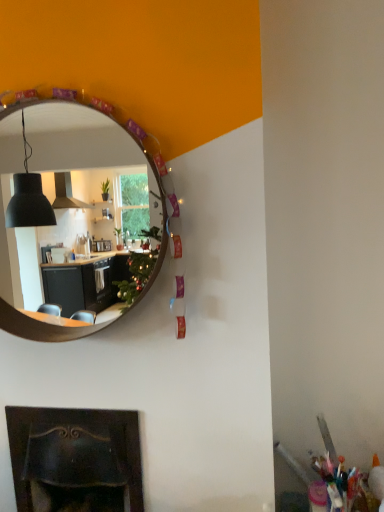
Question: Could you tell me if dark brown wood fireplace at lower left is facing wooden mirror at upper center?

Choices:
 (A) no
 (B) yes

Answer: (A)

Question: Is wooden mirror at upper center inside dark brown wood fireplace at lower left?

Choices:
 (A) no
 (B) yes

Answer: (A)

Question: Does dark brown wood fireplace at lower left have a larger size compared to wooden mirror at upper center?

Choices:
 (A) yes
 (B) no

Answer: (A)

Question: From the image's perspective, does dark brown wood fireplace at lower left appear higher than wooden mirror at upper center?

Choices:
 (A) yes
 (B) no

Answer: (B)

Question: Is dark brown wood fireplace at lower left facing away from wooden mirror at upper center?

Choices:
 (A) no
 (B) yes

Answer: (A)

Question: Is dark brown wood fireplace at lower left closer to the viewer compared to wooden mirror at upper center?

Choices:
 (A) yes
 (B) no

Answer: (B)

Question: From the image's perspective, would you say wooden mirror at upper center is shown under dark brown wood fireplace at lower left?

Choices:
 (A) no
 (B) yes

Answer: (A)

Question: Could you tell me if wooden mirror at upper center is facing dark brown wood fireplace at lower left?

Choices:
 (A) yes
 (B) no

Answer: (B)

Question: Can we say wooden mirror at upper center lies outside dark brown wood fireplace at lower left?

Choices:
 (A) yes
 (B) no

Answer: (A)

Question: Is the depth of wooden mirror at upper center less than that of dark brown wood fireplace at lower left?

Choices:
 (A) no
 (B) yes

Answer: (B)

Question: Can you confirm if wooden mirror at upper center is thinner than dark brown wood fireplace at lower left?

Choices:
 (A) no
 (B) yes

Answer: (B)

Question: Is wooden mirror at upper center bigger than dark brown wood fireplace at lower left?

Choices:
 (A) no
 (B) yes

Answer: (A)

Question: From the image's perspective, relative to dark brown wood fireplace at lower left, is wooden mirror at upper center above or below?

Choices:
 (A) below
 (B) above

Answer: (B)